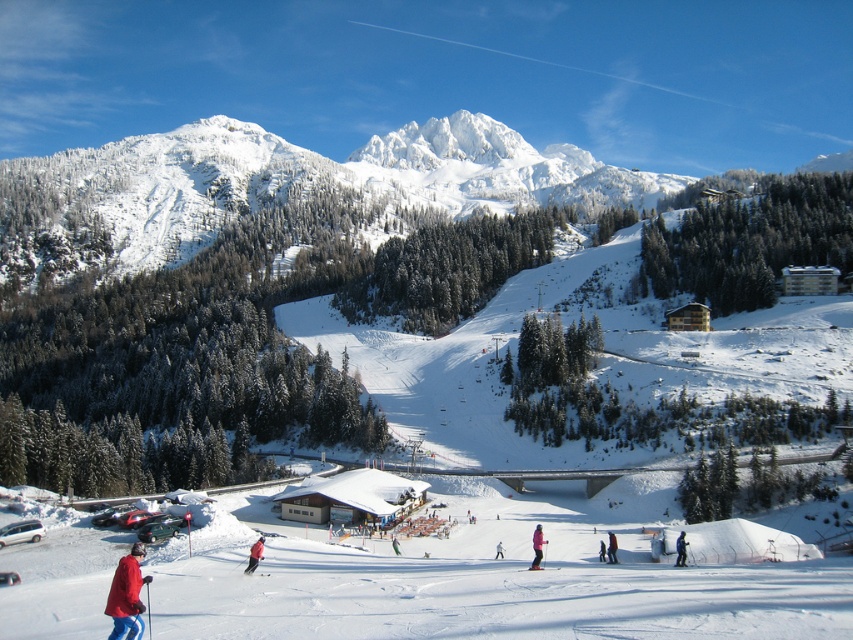
Between pink fabric jacket at center and red jacket at center, which one has more height?

pink fabric jacket at center

What do you see at coordinates (537, 547) in the screenshot? I see `pink fabric jacket at center` at bounding box center [537, 547].

Image resolution: width=853 pixels, height=640 pixels. In order to click on pink fabric jacket at center in this screenshot , I will do `click(537, 547)`.

Is red jacket at lower center shorter than matte red ski at center?

No, red jacket at lower center is not shorter than matte red ski at center.

Between red jacket at lower center and matte red ski at center, which one has less height?

Standing shorter between the two is matte red ski at center.

Measure the distance between red jacket at lower center and camera.

A distance of 58.99 meters exists between red jacket at lower center and camera.

This screenshot has height=640, width=853. Find the location of `red jacket at lower center`. red jacket at lower center is located at coordinates (611, 547).

Which is more to the left, matte pink jacket at lower center or pink fabric jacket at center?

matte pink jacket at lower center is more to the left.

Find the location of `matte pink jacket at lower center`. matte pink jacket at lower center is located at coordinates pos(254,556).

Is point (262, 544) farther from viewer compared to point (535, 538)?

Yes, point (262, 544) is farther from viewer.

Find the location of `matte pink jacket at lower center`. matte pink jacket at lower center is located at coordinates (254, 556).